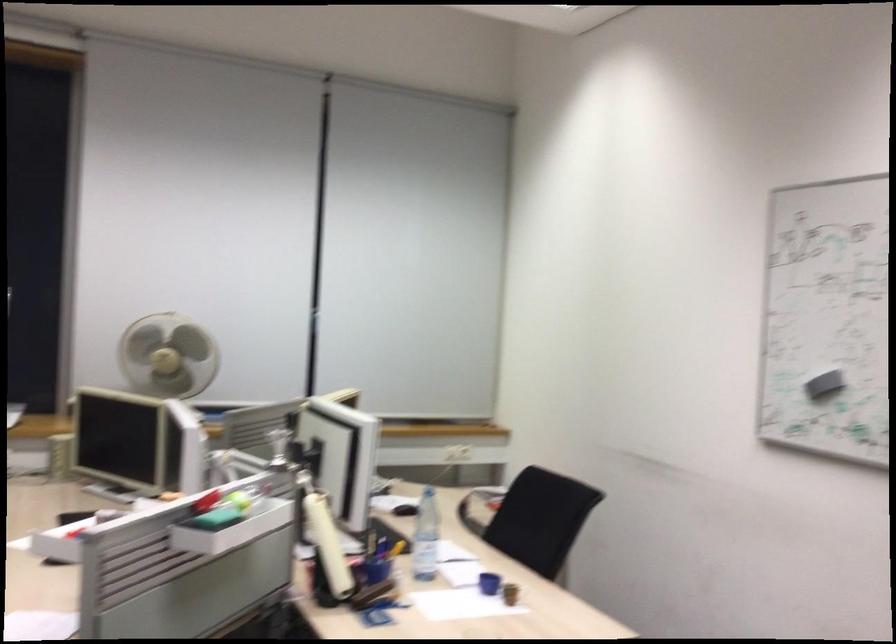
What do you see at coordinates (531, 518) in the screenshot?
I see `the chair sitting surface` at bounding box center [531, 518].